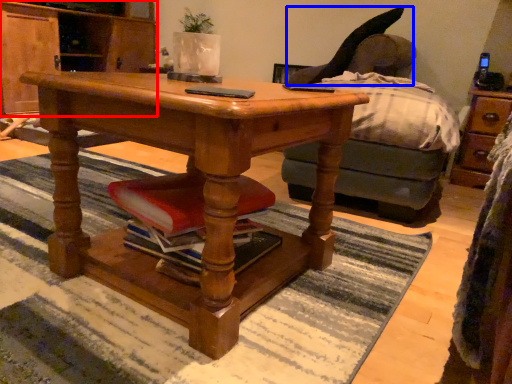
Question: Which object appears closest to the camera in this image, cabinetry (highlighted by a red box) or swivel chair (highlighted by a blue box)?

Choices:
 (A) cabinetry
 (B) swivel chair

Answer: (B)